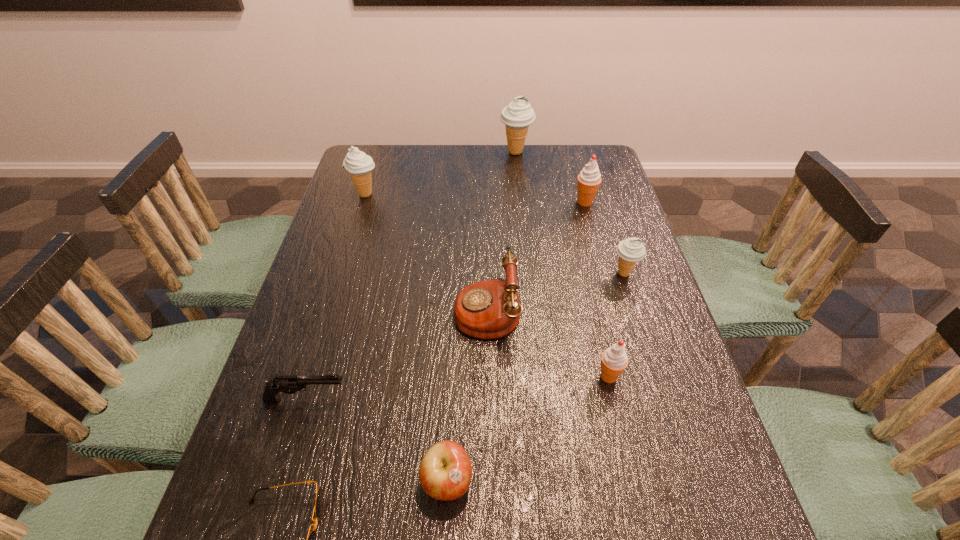
Locate an element on the screen. The width and height of the screenshot is (960, 540). vacant space located 0.400m on the left of the nearest beige icecream is located at coordinates [459, 273].

Identify the location of blank space located at the end of the barrel of the black gun. This screenshot has width=960, height=540. pos(474,400).

The width and height of the screenshot is (960, 540). In order to click on free space located 0.100m on the back of the apple in this screenshot , I will do `click(451, 406)`.

You are a GUI agent. You are given a task and a screenshot of the screen. Output one action in this format:
    pyautogui.click(x=<x>, y=<y>)
    Task: Click on the object that is positioned at the far edge
    The width and height of the screenshot is (960, 540).
    Given the screenshot: What is the action you would take?
    pyautogui.click(x=518, y=115)

Identify the location of icecream positioned at the left edge. The width and height of the screenshot is (960, 540). (359, 165).

This screenshot has width=960, height=540. Identify the location of gun present at the left edge. (289, 384).

In the image, there is a desktop. What are the coordinates of `vacant space at the far edge` in the screenshot? It's located at (498, 172).

Identify the location of free spot at the left edge of the desktop. (378, 227).

Find the location of a particular element. Image resolution: width=960 pixels, height=540 pixels. vacant region at the right edge of the desktop is located at coordinates (619, 314).

The height and width of the screenshot is (540, 960). What are the coordinates of `vacant space at the far left corner of the desktop` in the screenshot? It's located at (391, 171).